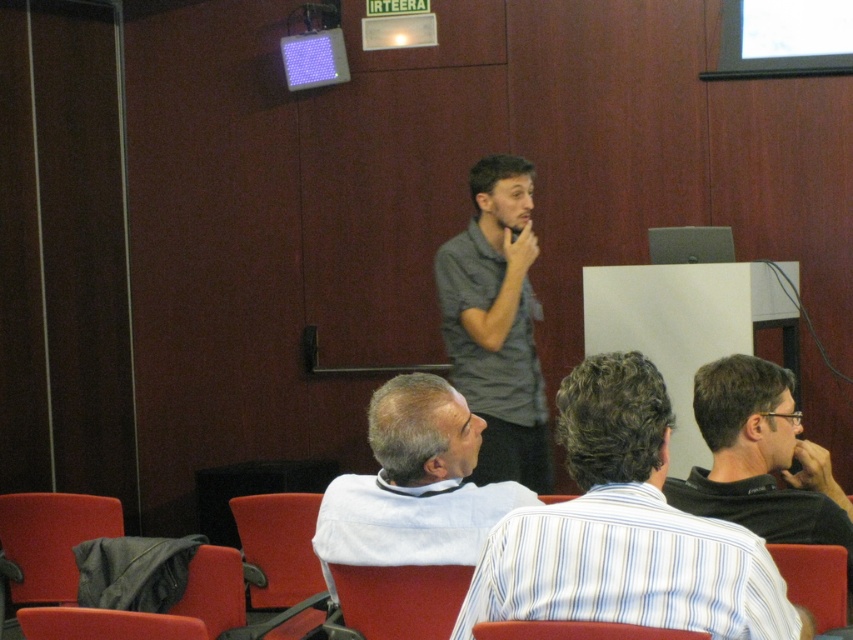
Between point (358, 602) and point (198, 618), which one is positioned in front?

Positioned in front is point (358, 602).

Is matte red chair at lower center thinner than matte red chair at lower left?

Correct, matte red chair at lower center's width is less than matte red chair at lower left's.

Identify the location of matte red chair at lower center. (401, 600).

Does black matte shirt at lower right appear under red fabric chair at lower left?

Incorrect, black matte shirt at lower right is not positioned below red fabric chair at lower left.

Can you confirm if black matte shirt at lower right is positioned to the left of red fabric chair at lower left?

Incorrect, black matte shirt at lower right is not on the left side of red fabric chair at lower left.

Identify the location of black matte shirt at lower right. (761, 460).

I want to click on black matte shirt at lower right, so click(x=761, y=460).

The image size is (853, 640). Describe the element at coordinates (761, 460) in the screenshot. I see `black matte shirt at lower right` at that location.

Between black matte shirt at lower right and red fabric chair at lower center, which one is positioned higher?

black matte shirt at lower right is higher up.

Does point (712, 500) come closer to viewer compared to point (564, 621)?

No, it is not.

I want to click on black matte shirt at lower right, so click(x=761, y=460).